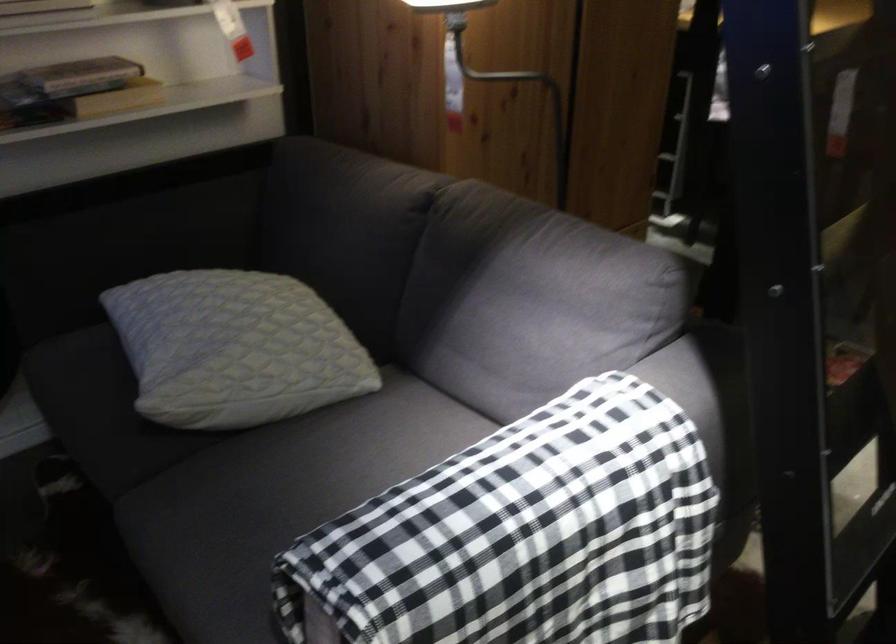
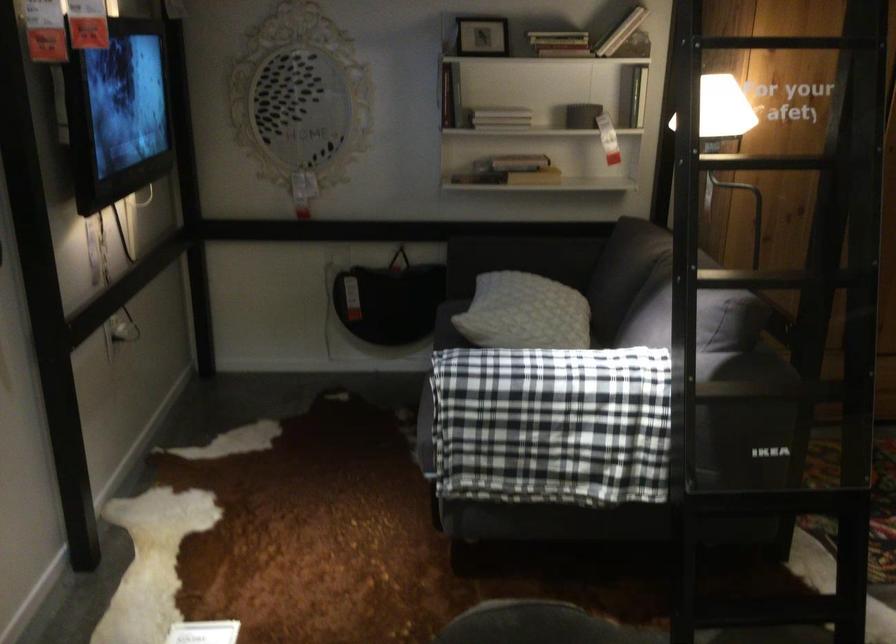
Find the pixel in the second image that matches [730,366] in the first image.

(745, 366)